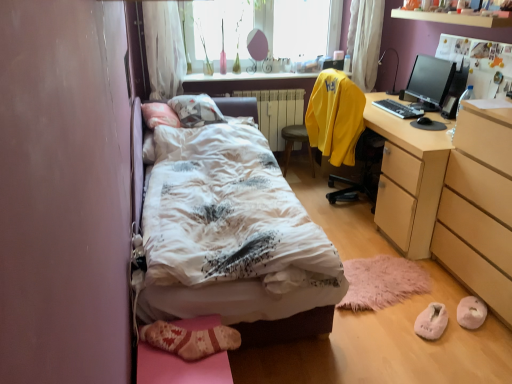
Locate an element on the screen. vacant area that is in front of black plastic keyboard at right is located at coordinates (407, 114).